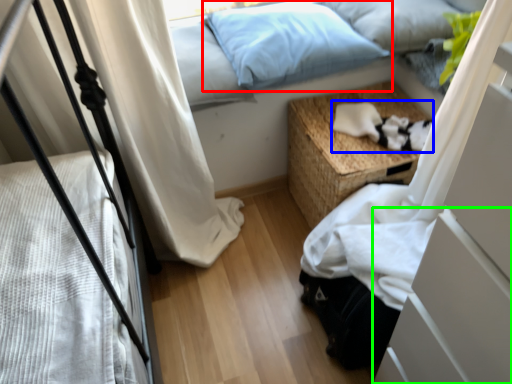
Question: Which object is positioned closest to pillow (highlighted by a red box)? Select from cat (highlighted by a blue box) and drawer (highlighted by a green box).

Choices:
 (A) cat
 (B) drawer

Answer: (A)